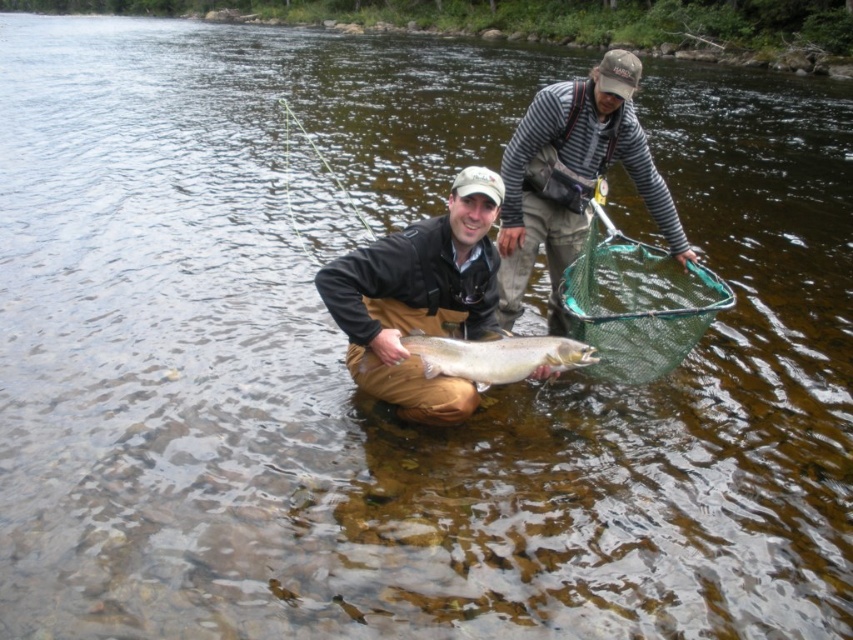
You are a fisherman trying to grab the shiny silver fish at center with a net. The matte brown waders at center are in your way. Can you reach the fish without moving the waders?

The distance between the matte brown waders at center and the shiny silver fish at center is 11.43 inches. Since the waders are in the way, you would need to move them to reach the fish safely. However, if the net can extend beyond 11.43 inches, you might reach it without moving the waders.

You are standing at the point marked as point (x=572, y=177) in the image. Looking around, you see the striped long sleeve shirt at upper right. What is the nearest object to you?

The nearest object to you is the striped long sleeve shirt at upper right since the point corresponds to its location.